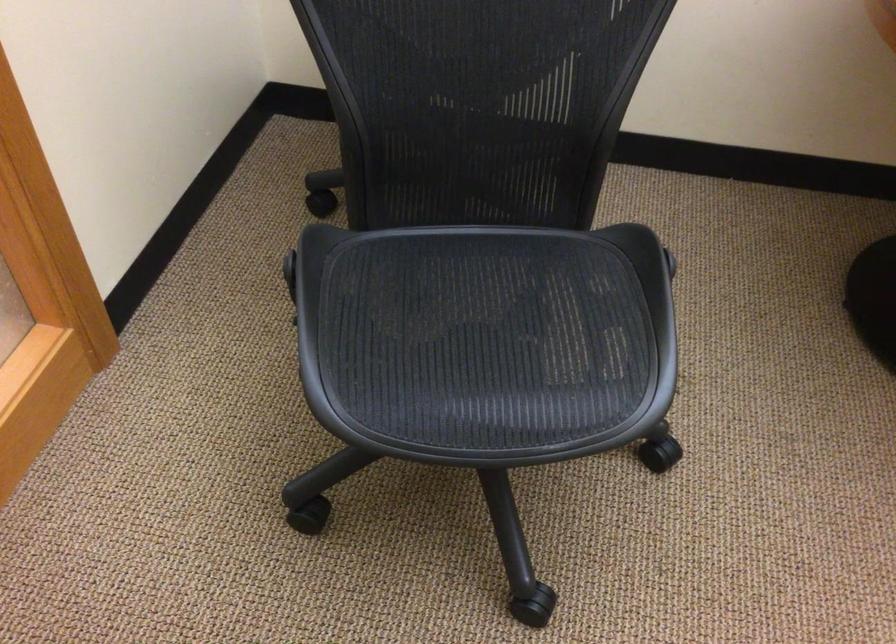
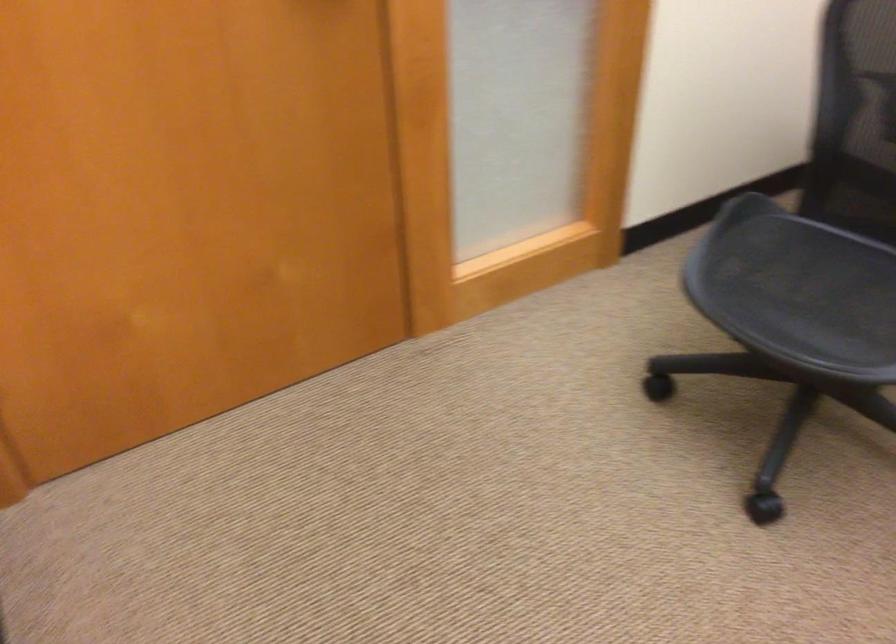
Where in the second image is the point corresponding to (481,355) from the first image?

(805, 295)